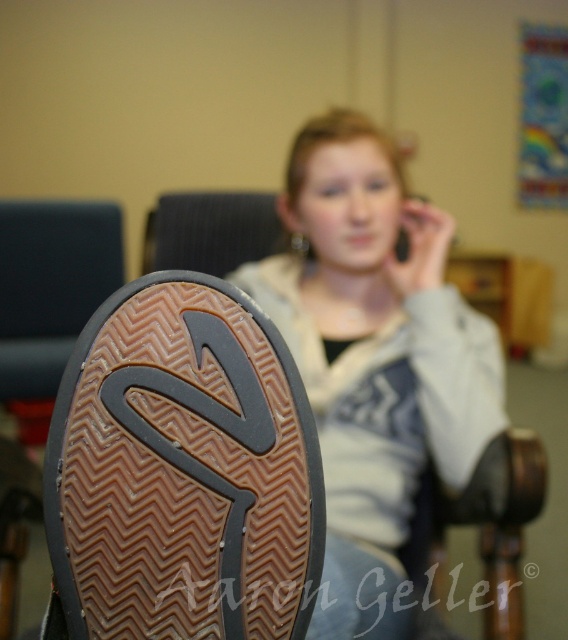
Question: Which point is closer to the camera?

Choices:
 (A) (428, 236)
 (B) (206, 602)

Answer: (B)

Question: Does brown rubber shoe at lower left appear over matte gray hoodie at center?

Choices:
 (A) no
 (B) yes

Answer: (A)

Question: Which object is closer to the camera taking this photo?

Choices:
 (A) matte gray hoodie at center
 (B) brown rubber shoe at lower left

Answer: (B)

Question: Is brown rubber shoe at lower left wider than matte gray hoodie at center?

Choices:
 (A) yes
 (B) no

Answer: (B)

Question: In this image, where is brown rubber shoe at lower left located relative to matte gray hoodie at center?

Choices:
 (A) right
 (B) left

Answer: (B)